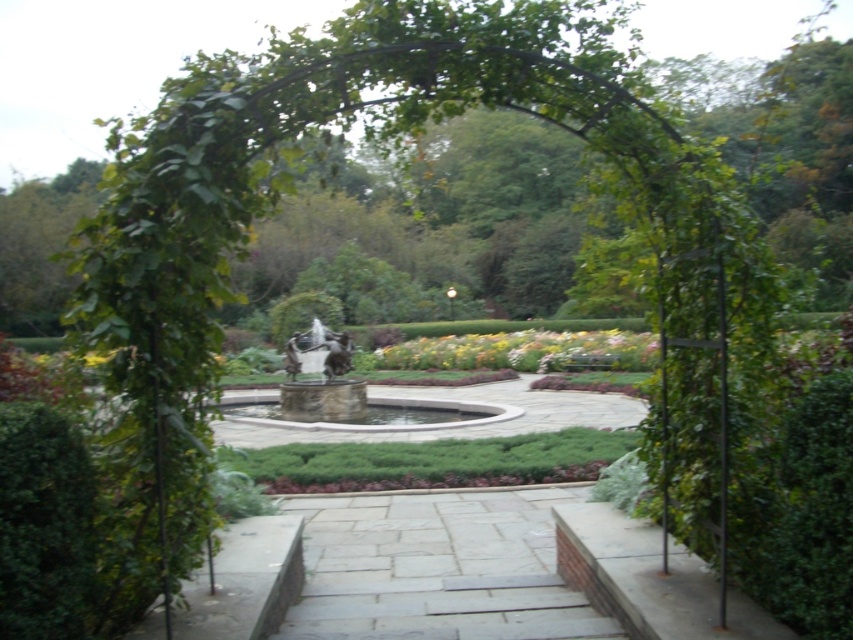
Does yellow matte flowers at center appear under polished bronze statue at center?

No.

What do you see at coordinates (526, 352) in the screenshot?
I see `yellow matte flowers at center` at bounding box center [526, 352].

Is point (418, 340) behind point (305, 356)?

Yes, point (418, 340) is farther from viewer.

The height and width of the screenshot is (640, 853). In order to click on yellow matte flowers at center in this screenshot , I will do `click(526, 352)`.

Who is lower down, white marble fountain at center or polished bronze statue at center?

white marble fountain at center

In the scene shown: Between white marble fountain at center and polished bronze statue at center, which one has less height?

Standing shorter between the two is white marble fountain at center.

Who is more distant from viewer, (277,403) or (318,339)?

The point (318,339) is behind.

Where is `white marble fountain at center`? white marble fountain at center is located at coordinates (355, 408).

Can you confirm if gray stone path at center is positioned to the right of white marble fountain at center?

In fact, gray stone path at center is to the left of white marble fountain at center.

Which is more to the right, gray stone path at center or white marble fountain at center?

white marble fountain at center is more to the right.

You are a GUI agent. You are given a task and a screenshot of the screen. Output one action in this format:
    pyautogui.click(x=<x>, y=<y>)
    Task: Click on the gray stone path at center
    
    Given the screenshot: What is the action you would take?
    pyautogui.click(x=437, y=568)

Find the location of a particular element. gray stone path at center is located at coordinates (437, 568).